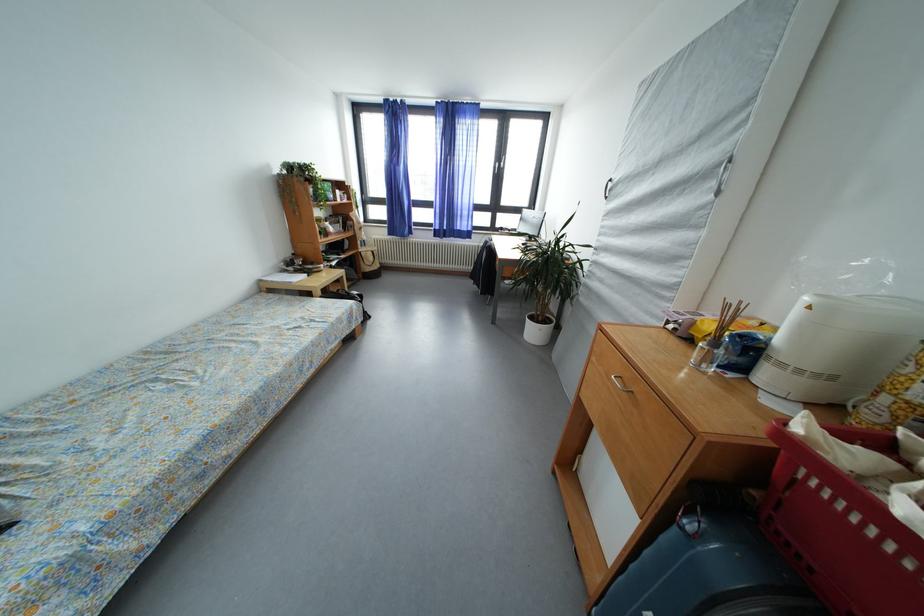
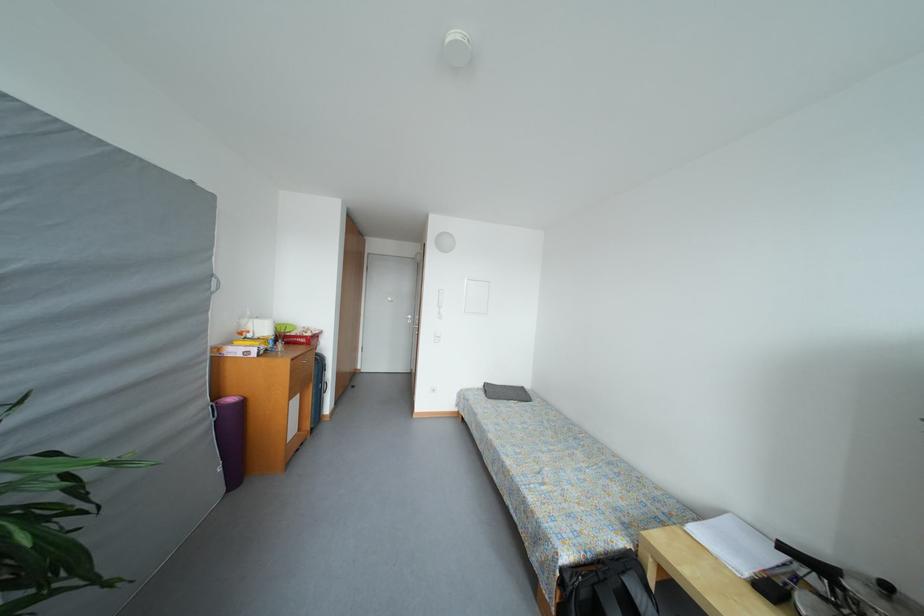
Locate, in the second image, the point that corresponds to [283,375] in the first image.

(496, 440)